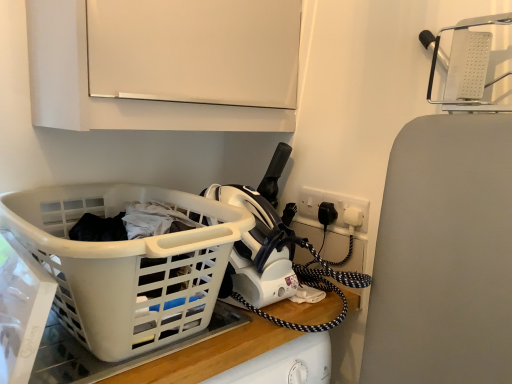
Image resolution: width=512 pixels, height=384 pixels. What do you see at coordinates (126, 264) in the screenshot?
I see `white plastic laundry basket at lower left` at bounding box center [126, 264].

The image size is (512, 384). Find the location of `white plastic socket at upper right`. white plastic socket at upper right is located at coordinates [334, 205].

Where is `white matte cabinet at upper center`? The height and width of the screenshot is (384, 512). white matte cabinet at upper center is located at coordinates (164, 64).

The height and width of the screenshot is (384, 512). In order to click on white plastic laundry basket at lower left in this screenshot , I will do `click(126, 264)`.

Which is in front, point (61, 201) or point (213, 5)?

The point (213, 5) is more forward.

Based on the photo, are white plastic laundry basket at lower left and white matte cabinet at upper center far apart?

No, white plastic laundry basket at lower left is in close proximity to white matte cabinet at upper center.

Does white plastic laundry basket at lower left turn towards white matte cabinet at upper center?

No, white plastic laundry basket at lower left is not facing towards white matte cabinet at upper center.

From a real-world perspective, which is physically below, white plastic laundry basket at lower left or white matte cabinet at upper center?

white plastic laundry basket at lower left.

Which point is more distant from viewer, (278, 70) or (356, 208)?

The point (278, 70) is more distant.

Considering the positions of objects white matte cabinet at upper center and white plastic socket at upper right in the image provided, who is more to the left, white matte cabinet at upper center or white plastic socket at upper right?

white matte cabinet at upper center is more to the left.

Is white matte cabinet at upper center positioned far away from white plastic socket at upper right?

No, white matte cabinet at upper center is not far from white plastic socket at upper right.

Considering the relative sizes of white matte cabinet at upper center and white plastic socket at upper right in the image provided, is white matte cabinet at upper center wider than white plastic socket at upper right?

Correct, the width of white matte cabinet at upper center exceeds that of white plastic socket at upper right.

Which is more to the right, white plastic socket at upper right or white matte cabinet at upper center?

white plastic socket at upper right is more to the right.

Between white plastic socket at upper right and white matte cabinet at upper center, which one has smaller size?

With smaller size is white plastic socket at upper right.

Considering their positions, is white plastic socket at upper right located in front of or behind white matte cabinet at upper center?

white plastic socket at upper right is positioned farther from the viewer than white matte cabinet at upper center.

Which of these two, white plastic socket at upper right or white plastic laundry basket at lower left, is bigger?

white plastic laundry basket at lower left is bigger.

From the picture: Is white plastic socket at upper right not near white plastic laundry basket at lower left?

No, white plastic socket at upper right is not far away from white plastic laundry basket at lower left.

How much distance is there between white plastic socket at upper right and white plastic laundry basket at lower left?

A distance of 52.37 centimeters exists between white plastic socket at upper right and white plastic laundry basket at lower left.

Is white plastic socket at upper right completely or partially outside of white plastic laundry basket at lower left?

Yes, white plastic socket at upper right is outside of white plastic laundry basket at lower left.

Identify the location of electric outlet above the white plastic laundry basket at lower left (from the image's perspective). The height and width of the screenshot is (384, 512). (334, 205).

Between white plastic laundry basket at lower left and white plastic socket at upper right, which one is positioned behind?

white plastic socket at upper right is further away from the camera.

Is white plastic laundry basket at lower left far from white plastic socket at upper right?

No, white plastic laundry basket at lower left is not far away from white plastic socket at upper right.

Does point (196, 257) lie behind point (308, 192)?

No, it is in front of (308, 192).

Does white matte cabinet at upper center touch white plastic laundry basket at lower left?

There is a gap between white matte cabinet at upper center and white plastic laundry basket at lower left.

From the image's perspective, is white matte cabinet at upper center on top of white plastic laundry basket at lower left?

Yes, from the image's perspective, white matte cabinet at upper center is over white plastic laundry basket at lower left.

Does white matte cabinet at upper center have a smaller size compared to white plastic laundry basket at lower left?

Actually, white matte cabinet at upper center might be larger than white plastic laundry basket at lower left.

Identify the location of basket below the white matte cabinet at upper center (from the image's perspective). (126, 264).

You are a GUI agent. You are given a task and a screenshot of the screen. Output one action in this format:
    pyautogui.click(x=<x>, y=<y>)
    Task: Click on the cabinetry lying in front of the white plastic socket at upper right
    The height and width of the screenshot is (384, 512).
    Given the screenshot: What is the action you would take?
    pyautogui.click(x=164, y=64)

From the image, which object appears to be farther from white plastic socket at upper right, white plastic laundry basket at lower left or white matte cabinet at upper center?

white plastic laundry basket at lower left is positioned further to the anchor white plastic socket at upper right.

Estimate the real-world distances between objects in this image. Which object is closer to white matte cabinet at upper center, white plastic socket at upper right or white plastic laundry basket at lower left?

white plastic laundry basket at lower left.

Estimate the real-world distances between objects in this image. Which object is closer to white plastic laundry basket at lower left, white matte cabinet at upper center or white plastic socket at upper right?

Based on the image, white matte cabinet at upper center appears to be nearer to white plastic laundry basket at lower left.

From the image, which object appears to be nearer to white plastic laundry basket at lower left, white plastic socket at upper right or white matte cabinet at upper center?

Among the two, white matte cabinet at upper center is located nearer to white plastic laundry basket at lower left.

In the scene shown: Considering their positions, is white plastic laundry basket at lower left positioned closer to white matte cabinet at upper center than white plastic socket at upper right?

white plastic laundry basket at lower left lies closer to white matte cabinet at upper center than the other object.

When comparing their distances from white plastic socket at upper right, does white matte cabinet at upper center or white plastic laundry basket at lower left seem closer?

Among the two, white matte cabinet at upper center is located nearer to white plastic socket at upper right.

The width and height of the screenshot is (512, 384). I want to click on cabinetry between white plastic laundry basket at lower left and white plastic socket at upper right in the horizontal direction, so click(x=164, y=64).